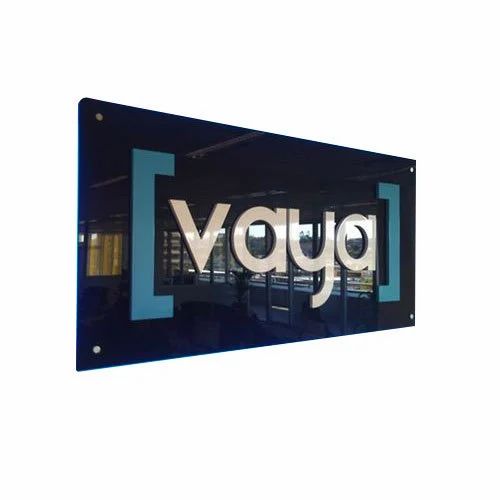
Locate an element on the screen. This screenshot has height=500, width=500. plant is located at coordinates (236, 282).